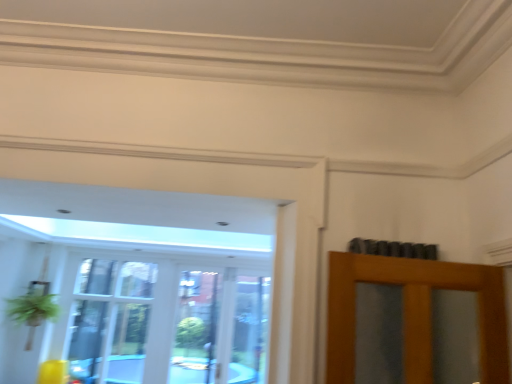
The height and width of the screenshot is (384, 512). Identify the location of transparent glass door at left. (111, 321).

This screenshot has height=384, width=512. Describe the element at coordinates (111, 321) in the screenshot. I see `transparent glass door at left` at that location.

The width and height of the screenshot is (512, 384). Identify the location of transparent glass door at left. (111, 321).